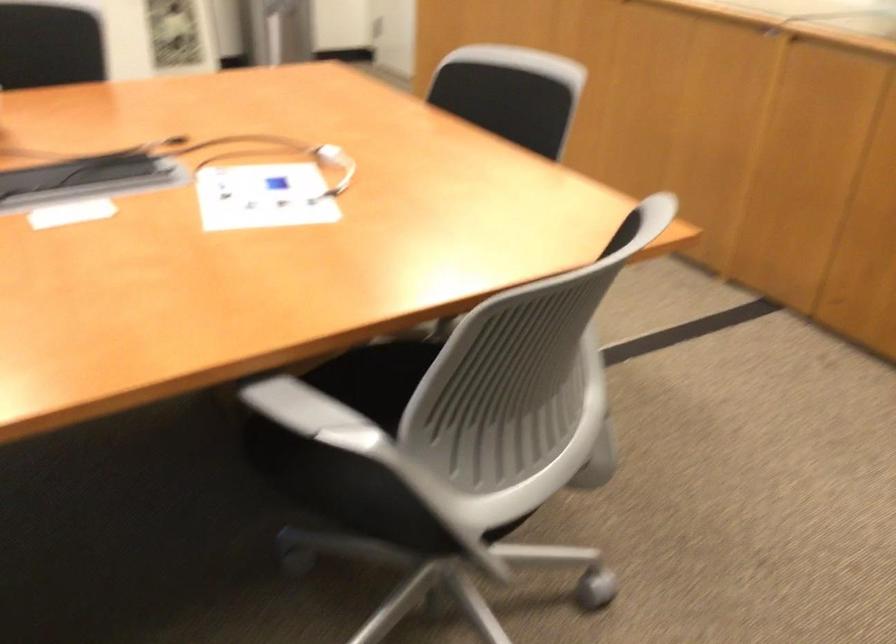
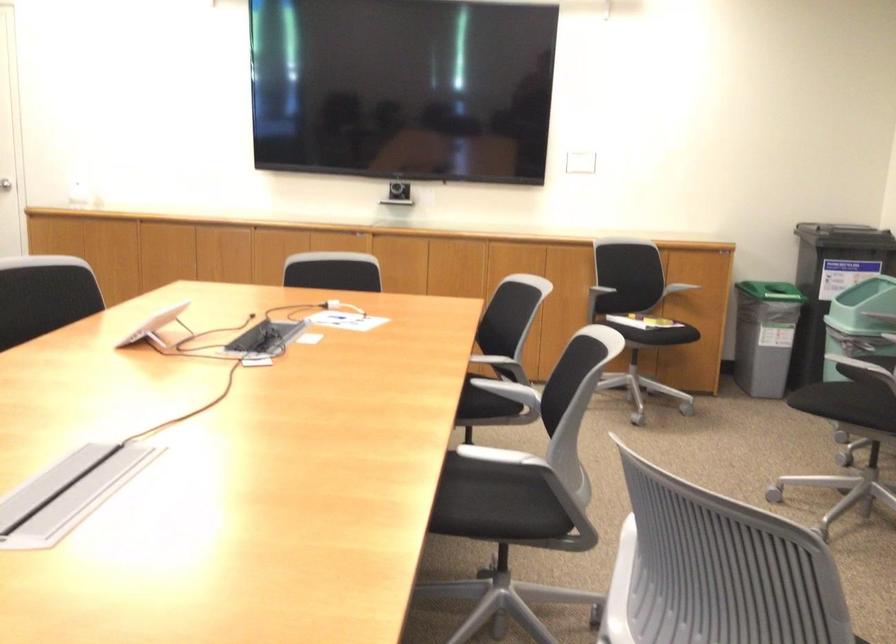
The point at (334,451) is marked in the first image. Where is the corresponding point in the second image?

(505, 366)